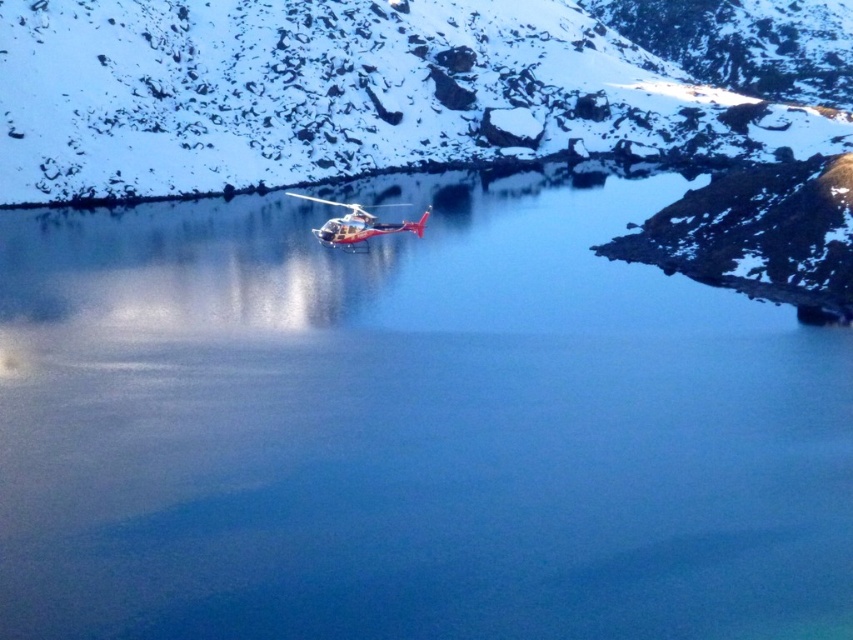
You are a photographer trying to capture the metallic silver helicopter at center in your shot. The matte white mountain at center is blocking part of the helicopter. Can you adjust your camera angle to fully frame the helicopter without the mountain obstructing it?

The matte white mountain at center is wider than the metallic silver helicopter at center, so adjusting the camera angle might not be possible since the mountain is wider and could still block part of the helicopter.

You are a photographer trying to capture the matte white mountain at center and the metallic silver helicopter at center in a single shot. Based on their sizes in the image, which object will appear larger in your photo?

The matte white mountain at center will appear larger in the photo because it is bigger than the metallic silver helicopter at center according to the description.

You are a drone operator trying to capture a photo of the matte white mountain at center. The drone is currently at point (381,90). Is the matte white mountain at center directly below the drone?

The point at (381,90) is where the matte white mountain at center is located, so yes, the matte white mountain at center is directly below the drone at that point.